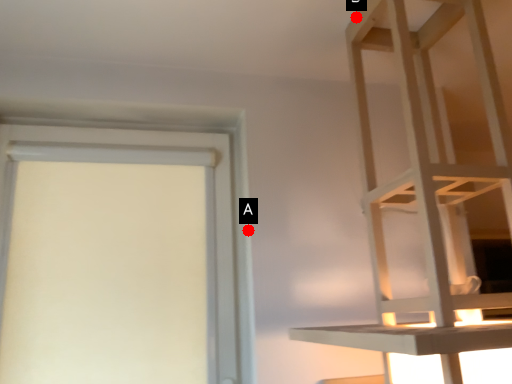
Question: Two points are circled on the image, labeled by A and B beside each circle. Which point appears closest to the camera in this image?

Choices:
 (A) A is closer
 (B) B is closer

Answer: (B)